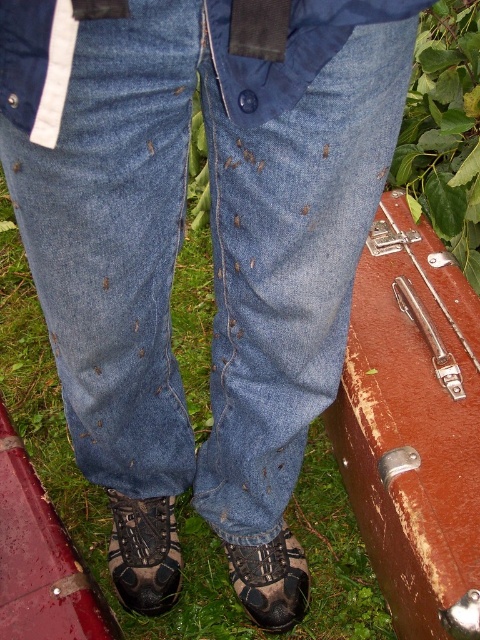
You are a photographer trying to capture the jeans in the image. The scene has a point at coordinates point (212, 232). What object is located at that point?

The point (212, 232) indicates denim at center.

You are standing in front of two boots, the brown leather boot at lower left and the brown suede boot at lower center. Which boot is closer to you?

The brown leather boot at lower left is closer to you because it is positioned further to the viewer than the brown suede boot at lower center.